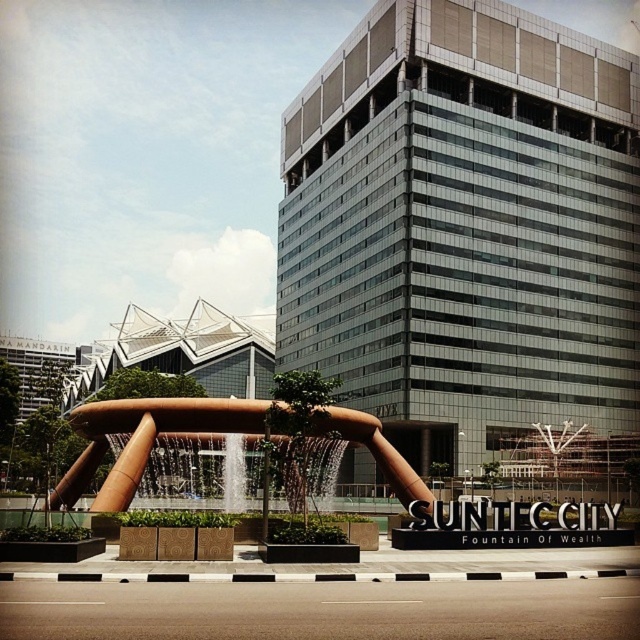
Question: Among these points, which one is farthest from the camera?

Choices:
 (A) (209, 465)
 (B) (88, 444)

Answer: (B)

Question: Can you confirm if gold metallic sculpture at center is smaller than clear glass water at center?

Choices:
 (A) no
 (B) yes

Answer: (A)

Question: Does gold metallic sculpture at center appear on the right side of clear glass water at center?

Choices:
 (A) yes
 (B) no

Answer: (B)

Question: Is gold metallic sculpture at center to the left of clear glass water at center from the viewer's perspective?

Choices:
 (A) yes
 (B) no

Answer: (A)

Question: Which point is closer to the camera?

Choices:
 (A) clear glass water at center
 (B) gold metallic sculpture at center

Answer: (B)